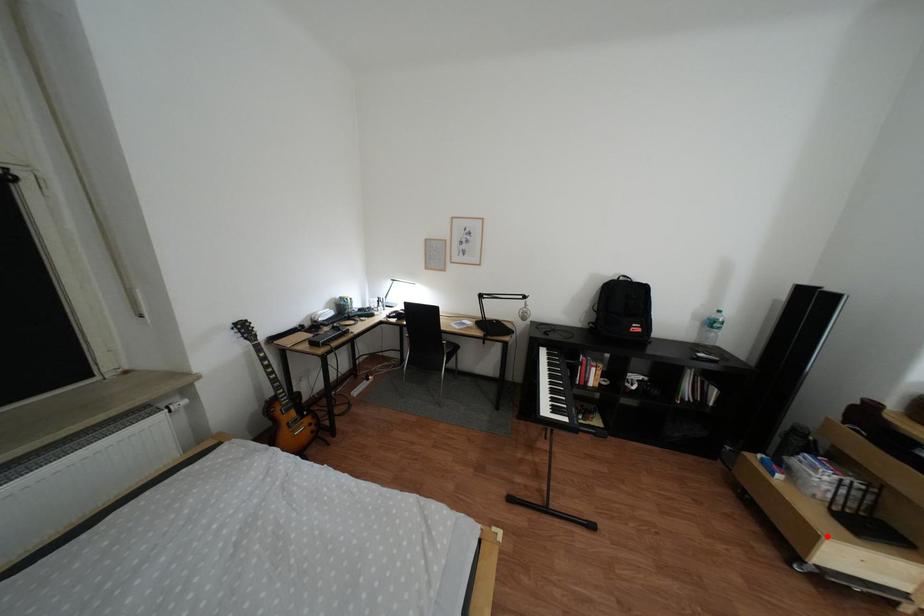
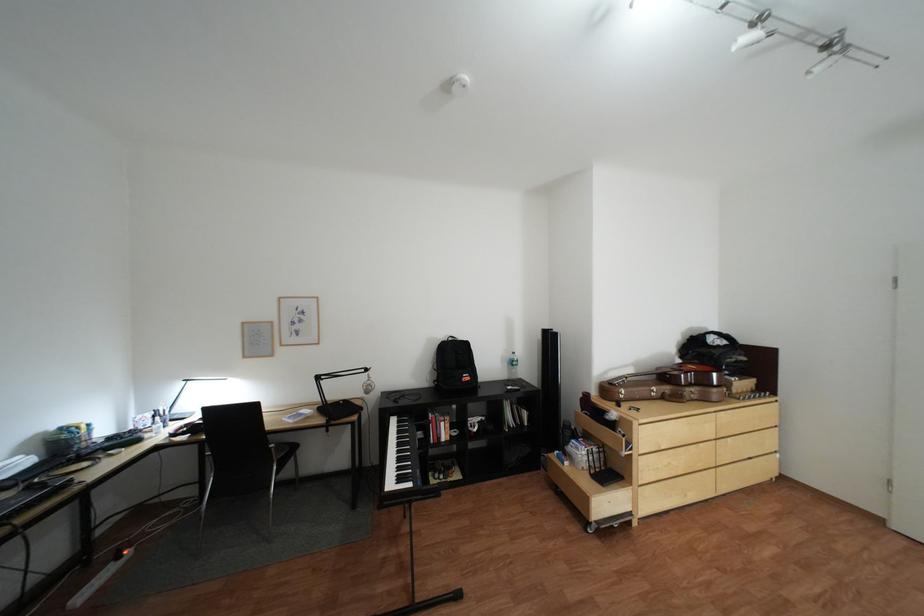
Where in the second image is the point corresponding to the highlighted location from the first image?

(602, 500)